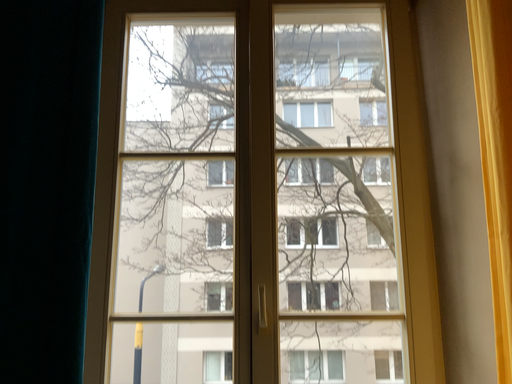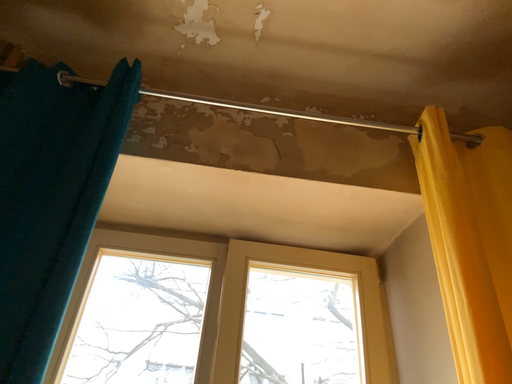
Question: Which way did the camera rotate in the video?

Choices:
 (A) rotated downward
 (B) rotated upward

Answer: (B)